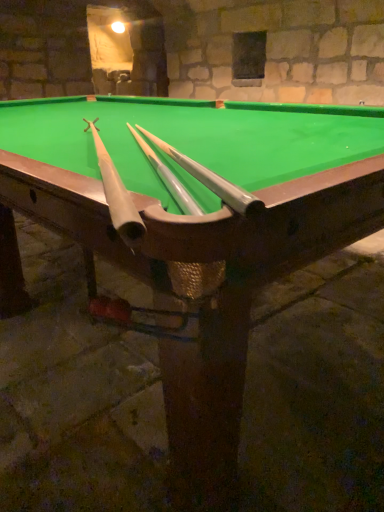
Question: Which direction should I rotate to face silver metallic cue at center, which is counted as the second cue, starting from the left, — up or down?

Choices:
 (A) down
 (B) up

Answer: (B)

Question: From a real-world perspective, does silver metallic cue at center, which is the 1th cue from right to left, sit lower than matte white cue at center, the second cue viewed from the right?

Choices:
 (A) yes
 (B) no

Answer: (A)

Question: Is silver metallic cue at center, which is counted as the second cue, starting from the left, oriented away from matte white cue at center, which is counted as the first cue, starting from the left?

Choices:
 (A) no
 (B) yes

Answer: (A)

Question: From a real-world perspective, is silver metallic cue at center, which is the 1th cue from right to left, positioned over matte white cue at center, the second cue viewed from the right, based on gravity?

Choices:
 (A) no
 (B) yes

Answer: (A)

Question: Does silver metallic cue at center, which is counted as the second cue, starting from the left, have a greater width compared to matte white cue at center, the second cue viewed from the right?

Choices:
 (A) yes
 (B) no

Answer: (B)

Question: From the image's perspective, is silver metallic cue at center, which is counted as the second cue, starting from the left, located beneath matte white cue at center, the second cue viewed from the right?

Choices:
 (A) no
 (B) yes

Answer: (A)

Question: Is silver metallic cue at center, which is counted as the second cue, starting from the left, to the left of matte white cue at center, the second cue viewed from the right, from the viewer's perspective?

Choices:
 (A) no
 (B) yes

Answer: (A)

Question: Can you confirm if matte white cue at center, the second cue viewed from the right, is smaller than silver metallic cue at center, which is the 1th cue from right to left?

Choices:
 (A) no
 (B) yes

Answer: (A)

Question: Considering the relative sizes of matte white cue at center, which is counted as the first cue, starting from the left, and silver metallic cue at center, which is counted as the second cue, starting from the left, in the image provided, is matte white cue at center, which is counted as the first cue, starting from the left, thinner than silver metallic cue at center, which is counted as the second cue, starting from the left,?

Choices:
 (A) no
 (B) yes

Answer: (A)

Question: Is matte white cue at center, the second cue viewed from the right, positioned with its back to silver metallic cue at center, which is the 1th cue from right to left?

Choices:
 (A) yes
 (B) no

Answer: (B)

Question: Is the position of matte white cue at center, the second cue viewed from the right, less distant than that of silver metallic cue at center, which is the 1th cue from right to left?

Choices:
 (A) yes
 (B) no

Answer: (A)

Question: From the image's perspective, is matte white cue at center, which is counted as the first cue, starting from the left, over silver metallic cue at center, which is the 1th cue from right to left?

Choices:
 (A) yes
 (B) no

Answer: (B)

Question: Is matte white cue at center, the second cue viewed from the right, shorter than silver metallic cue at center, which is counted as the second cue, starting from the left?

Choices:
 (A) no
 (B) yes

Answer: (A)

Question: Considering the positions of matte white cue at center, which is counted as the first cue, starting from the left, and silver metallic cue at center, which is the 1th cue from right to left, in the image, is matte white cue at center, which is counted as the first cue, starting from the left, bigger or smaller than silver metallic cue at center, which is the 1th cue from right to left,?

Choices:
 (A) big
 (B) small

Answer: (A)